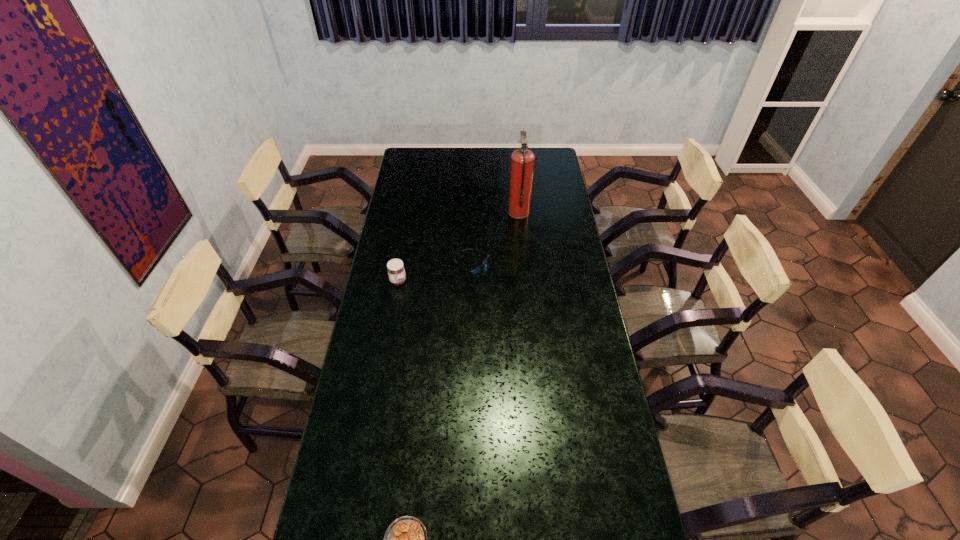
Find the location of a particular element. This screenshot has width=960, height=540. vacant space that's between the farthest object and the second tallest object is located at coordinates (459, 247).

At what (x,y) coordinates should I click in order to perform the action: click on object that is the second closest to the jam. Please return your answer as a coordinate pair (x, y). The image size is (960, 540). Looking at the image, I should click on (522, 160).

Point out which object is positioned as the third nearest to the rightmost object. Please provide its 2D coordinates. Your answer should be formatted as a tuple, i.e. [(x, y)], where the tuple contains the x and y coordinates of a point satisfying the conditions above.

[(405, 539)]